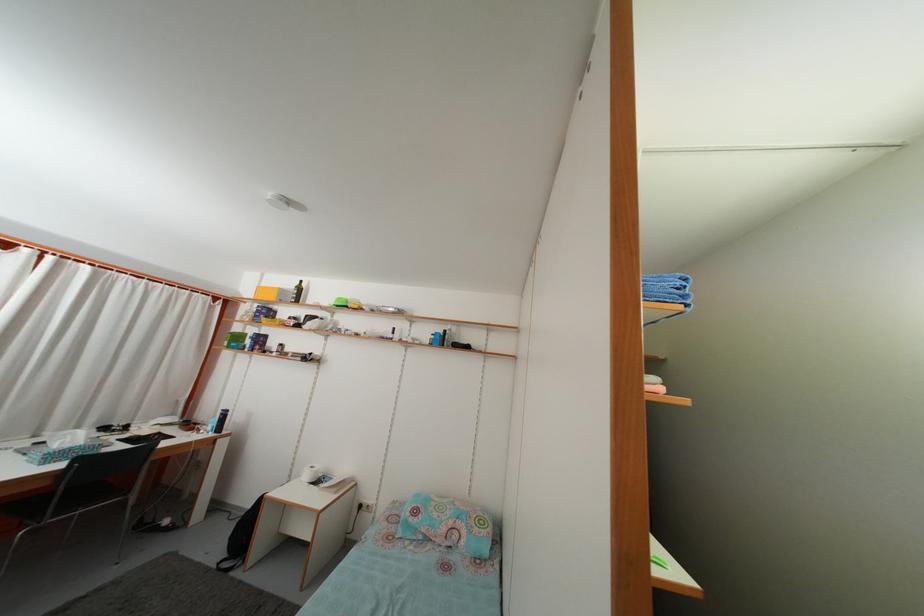
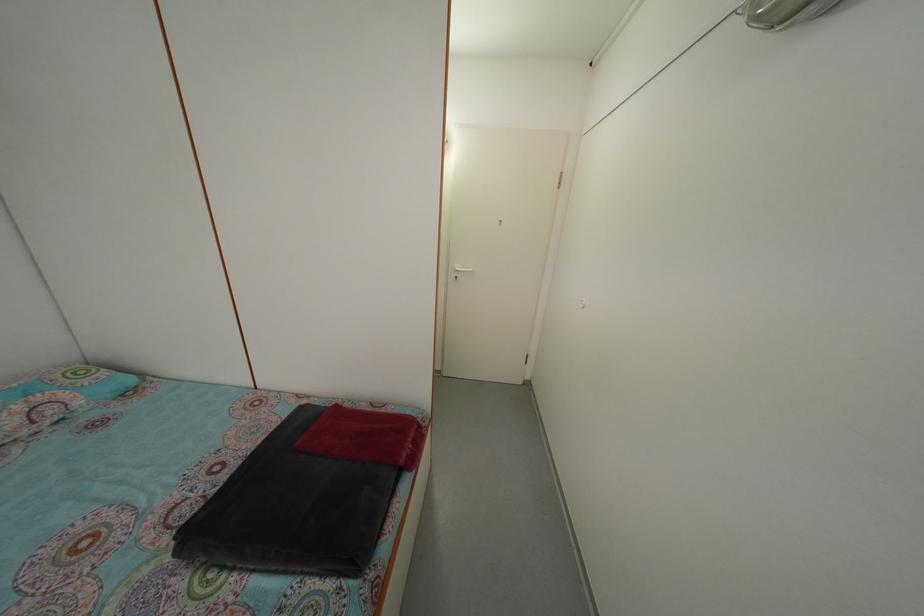
How did the camera likely rotate?

The camera's rotation is toward right-down.